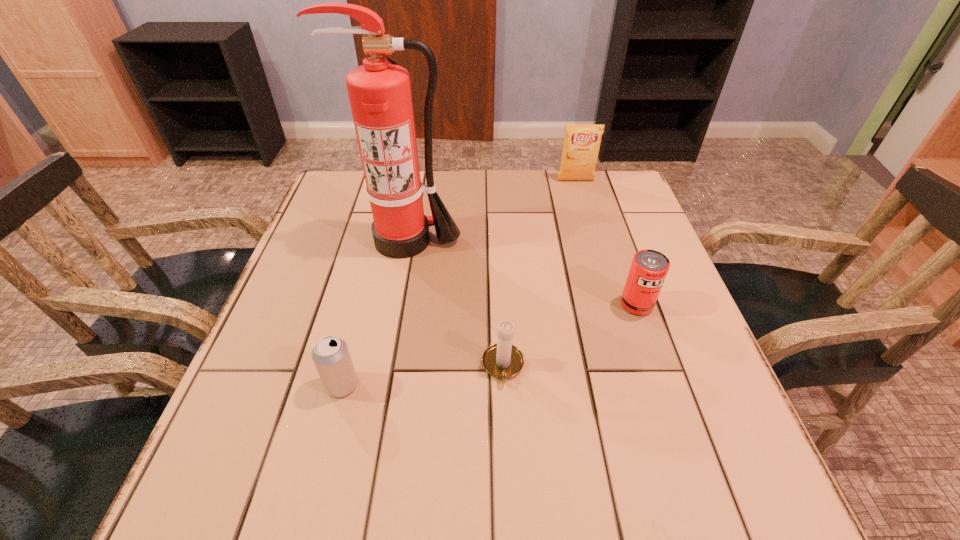
Locate an element on the screen. The width and height of the screenshot is (960, 540). vacant space situated on the handle side of the candle holder is located at coordinates (505, 414).

This screenshot has width=960, height=540. In order to click on vacant space located 0.380m on the back of the beer can in this screenshot , I will do `click(379, 242)`.

Identify the location of object that is positioned at the far edge. (581, 146).

Where is `fire extinguisher present at the left edge`? fire extinguisher present at the left edge is located at coordinates click(379, 92).

I want to click on beer can situated at the left edge, so click(x=331, y=356).

Find the location of a particular element. crisp (potato chip) positioned at the right edge is located at coordinates 581,146.

Where is `can situated at the right edge`? This screenshot has width=960, height=540. can situated at the right edge is located at coordinates (649, 268).

Where is `object that is at the far right corner`? object that is at the far right corner is located at coordinates (581, 146).

You are a GUI agent. You are given a task and a screenshot of the screen. Output one action in this format:
    pyautogui.click(x=<x>, y=<y>)
    Task: Click on the vacant space at the far edge of the desktop
    This screenshot has width=960, height=540.
    Given the screenshot: What is the action you would take?
    pyautogui.click(x=451, y=180)

This screenshot has width=960, height=540. In order to click on vacant space at the near edge in this screenshot , I will do `click(387, 468)`.